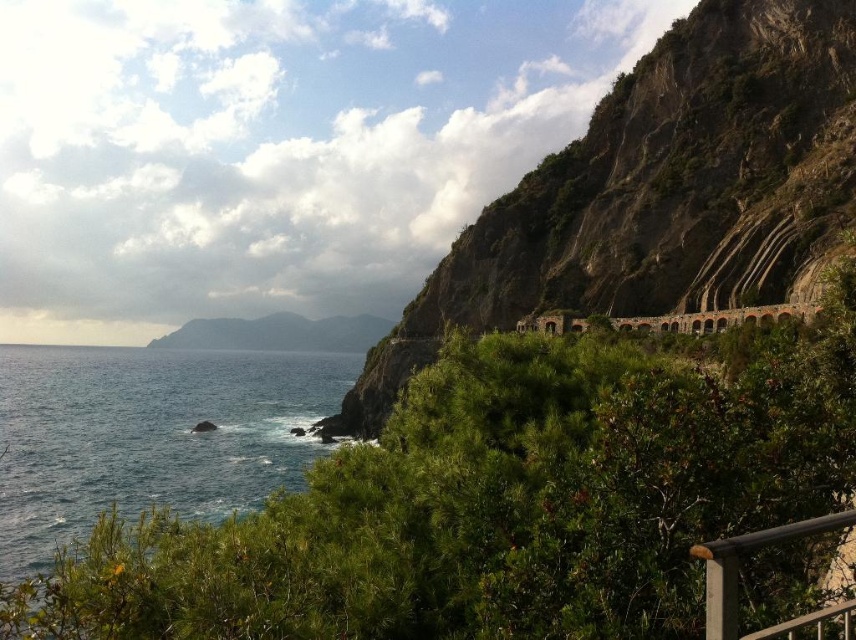
Question: Which point is closer to the camera?

Choices:
 (A) (60, 433)
 (B) (829, 166)
 (C) (822, 627)

Answer: (C)

Question: Can you confirm if rugged stone cliff at right is thinner than blue liquid water at lower left?

Choices:
 (A) no
 (B) yes

Answer: (B)

Question: Which object appears farthest from the camera in this image?

Choices:
 (A) blue liquid water at lower left
 (B) rugged stone cliff at right
 (C) silver metallic balustrade at lower right

Answer: (B)

Question: In this image, where is rugged stone cliff at right located relative to blue liquid water at lower left?

Choices:
 (A) above
 (B) below

Answer: (A)

Question: Which point is farther to the camera?

Choices:
 (A) (97, 403)
 (B) (733, 147)
 (C) (706, 588)

Answer: (A)

Question: Is rugged stone cliff at right thinner than blue liquid water at lower left?

Choices:
 (A) no
 (B) yes

Answer: (B)